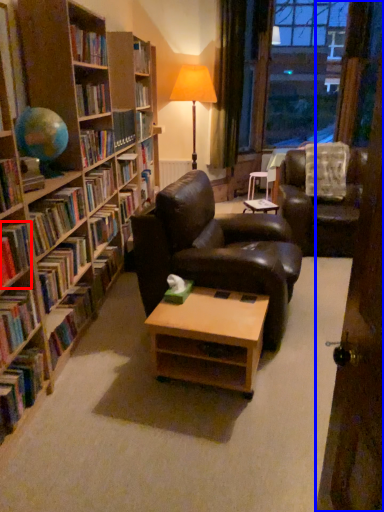
Question: Which of the following is the farthest to the observer, book (highlighted by a red box) or door (highlighted by a blue box)?

Choices:
 (A) book
 (B) door

Answer: (A)